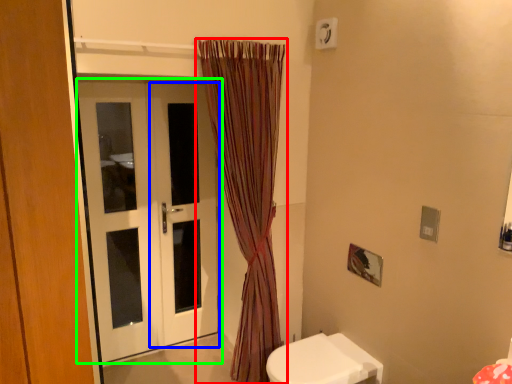
Question: Which object is positioned closest to curtain (highlighted by a red box)? Select from screen door (highlighted by a blue box) and door (highlighted by a green box).

Choices:
 (A) screen door
 (B) door

Answer: (A)